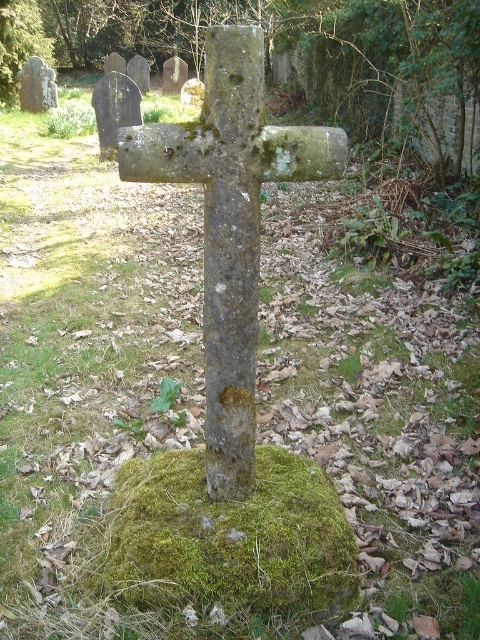
Between green mossy cross at center and green mossy stone cross at center, which one appears on the left side from the viewer's perspective?

green mossy cross at center

Can you confirm if green mossy cross at center is positioned to the left of green mossy stone cross at center?

Yes, green mossy cross at center is to the left of green mossy stone cross at center.

Image resolution: width=480 pixels, height=640 pixels. Describe the element at coordinates (284, 51) in the screenshot. I see `green mossy cross at center` at that location.

Where is `green mossy cross at center`? green mossy cross at center is located at coordinates (284, 51).